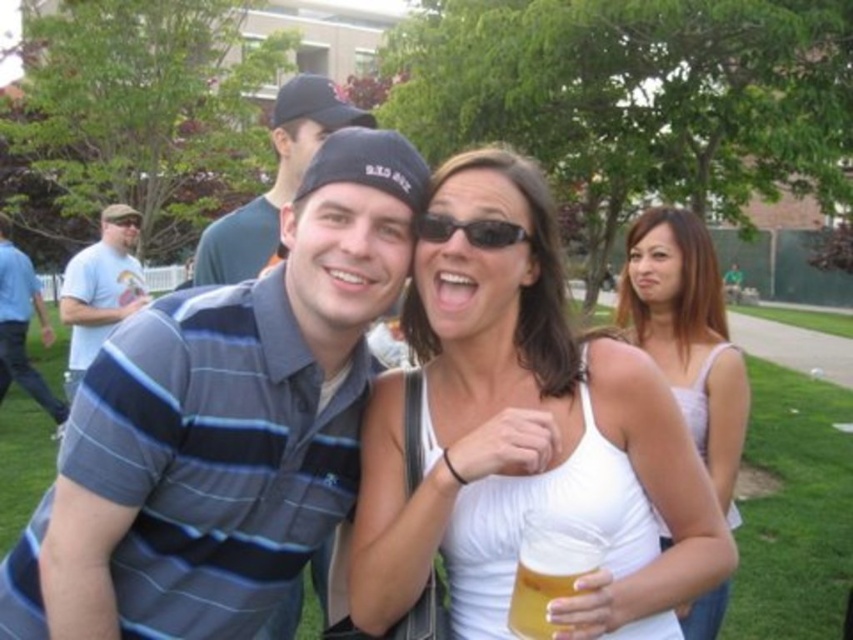
Please look at the coordinates provided. Is the point at (222, 426) located near the blue striped polo shirt at center?

Yes, the point at (222, 426) marks the blue striped polo shirt at center.